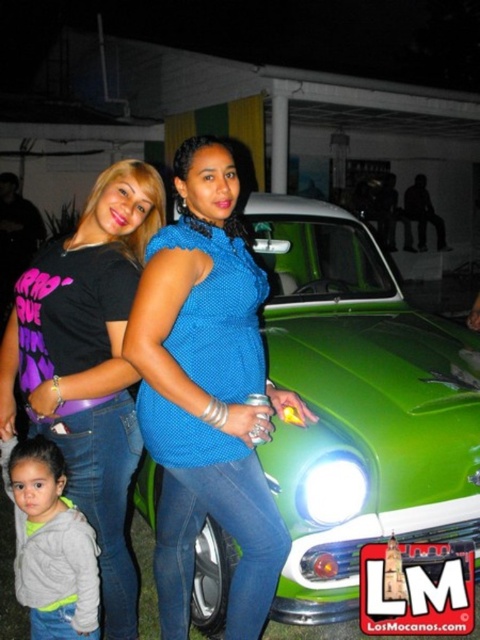
You are a photographer trying to focus on the blue knitted sweater at center and the gray fleece jacket at lower left. Which one should you adjust your camera focus to first to ensure both are in focus?

The blue knitted sweater at center is closer to the viewer than the gray fleece jacket at lower left, so you should focus on the gray fleece jacket at lower left first to ensure both are in focus.